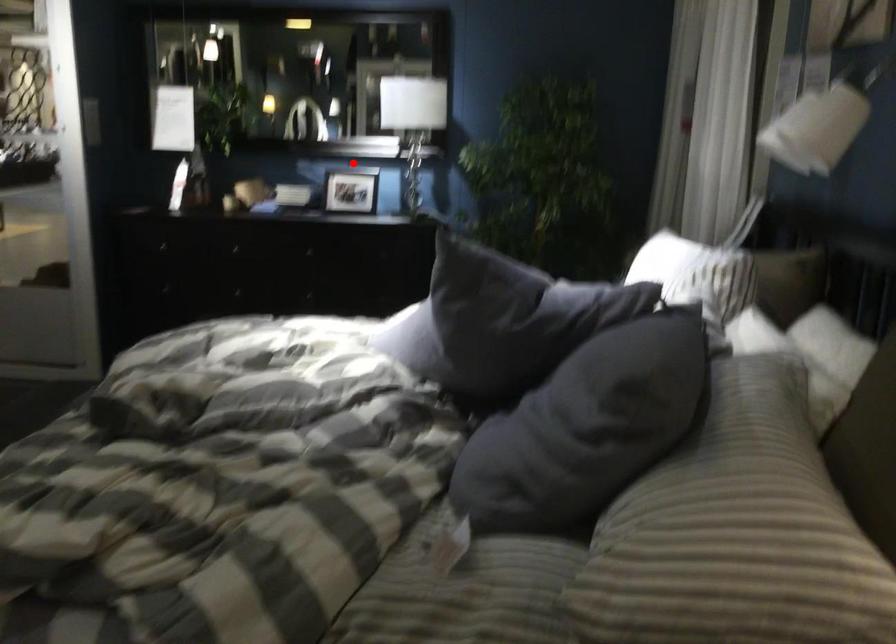
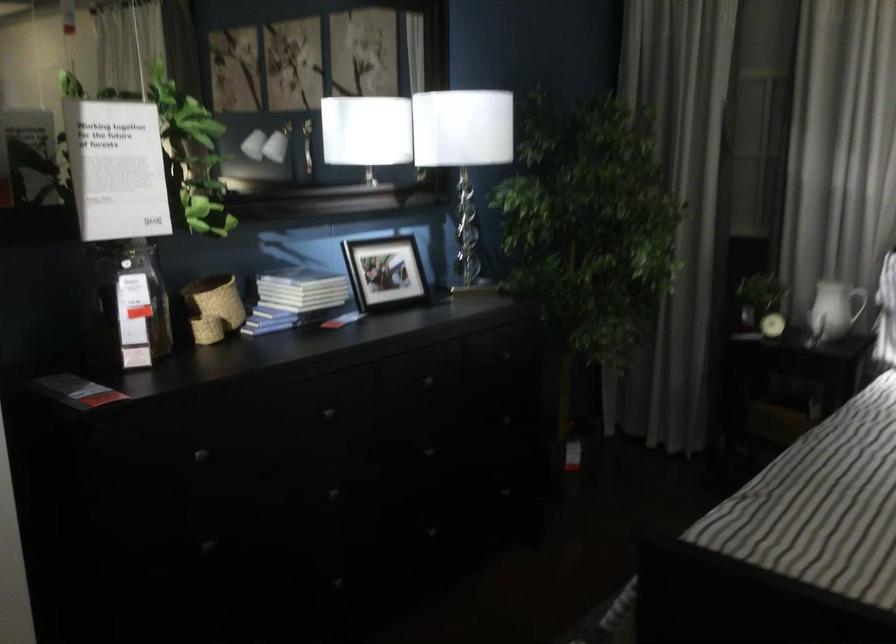
Question: I am providing you with two images of the same scene from different viewpoints. A red point is shown in image1. For the corresponding object point in image2, is it positioned nearer or farther from the camera?

Choices:
 (A) Nearer
 (B) Farther

Answer: (A)